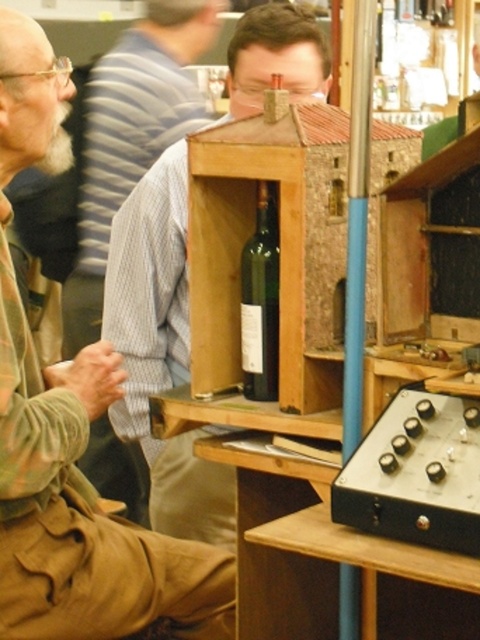
Does light brown shirt at left have a lesser height compared to white beard at left?

No, light brown shirt at left is not shorter than white beard at left.

Does light brown shirt at left lie in front of white beard at left?

That is False.

Where is `light brown shirt at left`? light brown shirt at left is located at coordinates (131, 136).

Does green glass bottle at center have a greater width compared to white beard at left?

No.

Does green glass bottle at center come behind white beard at left?

Yes, it is behind white beard at left.

Who is more forward, (277, 260) or (61, 113)?

Point (61, 113) is more forward.

Find the location of `green glass bottle at center`. green glass bottle at center is located at coordinates (261, 301).

Does light brown wood at center have a smaller size compared to white beard at left?

No.

From the picture: Is light brown wood at center wider than white beard at left?

Indeed, light brown wood at center has a greater width compared to white beard at left.

This screenshot has width=480, height=640. What do you see at coordinates (162, 352) in the screenshot?
I see `light brown wood at center` at bounding box center [162, 352].

This screenshot has width=480, height=640. In order to click on light brown wood at center in this screenshot , I will do `click(162, 352)`.